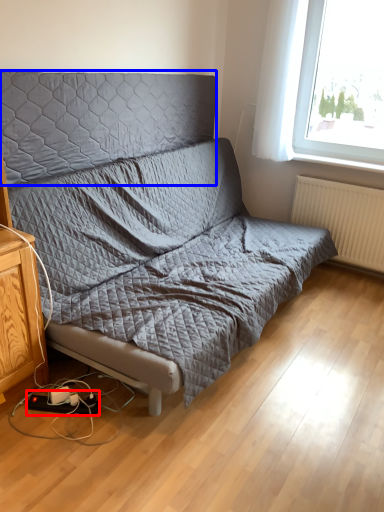
Question: Among these objects, which one is nearest to the camera, equipment (highlighted by a red box) or headboard (highlighted by a blue box)?

Choices:
 (A) equipment
 (B) headboard

Answer: (B)